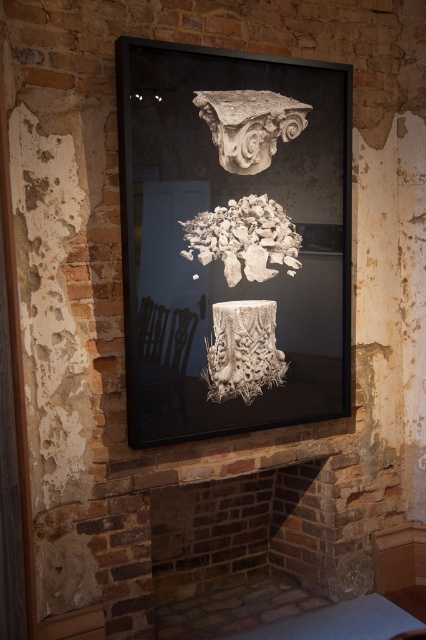
This screenshot has height=640, width=426. I want to click on black glass picture frame at center, so click(x=233, y=237).

Does black glass picture frame at center appear under white stone column capital at upper center?

Indeed, black glass picture frame at center is positioned under white stone column capital at upper center.

Is point (313, 173) farther from camera compared to point (301, 129)?

That is True.

The image size is (426, 640). Find the location of `black glass picture frame at center`. black glass picture frame at center is located at coordinates (233, 237).

In the scene shown: Who is taller, white textured rubble at center or white textured column at center?

Standing taller between the two is white textured column at center.

You are a GUI agent. You are given a task and a screenshot of the screen. Output one action in this format:
    pyautogui.click(x=<x>, y=<y>)
    Task: Click on the white textured rubble at center
    The height and width of the screenshot is (640, 426).
    Given the screenshot: What is the action you would take?
    pyautogui.click(x=244, y=237)

The height and width of the screenshot is (640, 426). What are the coordinates of `white textured rubble at center` in the screenshot? It's located at (244, 237).

Is point (221, 256) positioned in front of point (262, 92)?

Yes, it is.

Between white textured rubble at center and white stone column capital at upper center, which one has less height?

With less height is white stone column capital at upper center.

Is point (247, 240) closer to viewer compared to point (218, 129)?

No.

The width and height of the screenshot is (426, 640). Find the location of `white textured rubble at center`. white textured rubble at center is located at coordinates (244, 237).